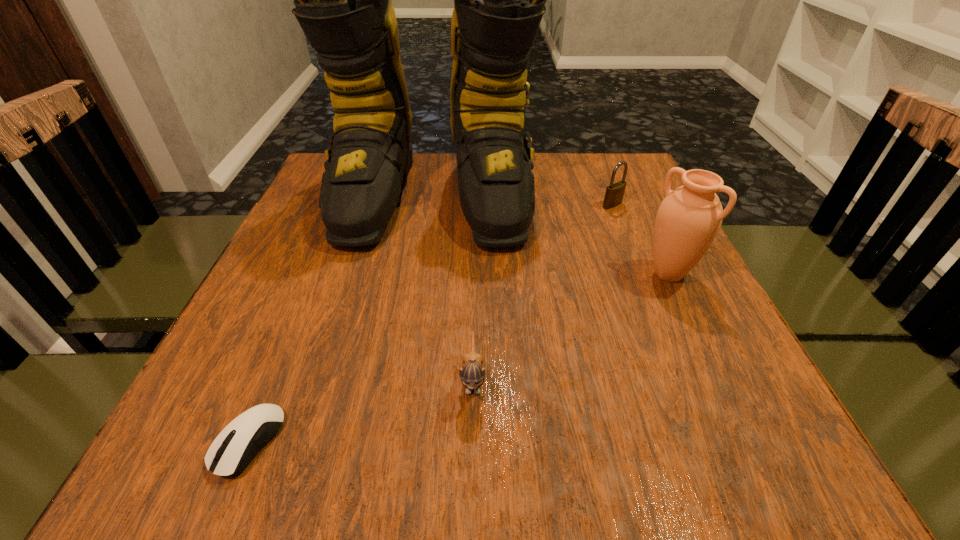
Locate an element on the screen. ski boots is located at coordinates (343, 0).

This screenshot has height=540, width=960. Find the location of `the second tallest object`. the second tallest object is located at coordinates (688, 219).

This screenshot has width=960, height=540. I want to click on urn, so click(x=688, y=219).

I want to click on padlock, so click(614, 194).

Where is `kitten`? kitten is located at coordinates (472, 374).

The width and height of the screenshot is (960, 540). In order to click on the shortest object in this screenshot , I will do `click(234, 448)`.

Image resolution: width=960 pixels, height=540 pixels. I want to click on free point located on the right of the ski boots, so click(612, 197).

I want to click on vacant space located on the back of the third nearest object, so click(x=652, y=239).

Where is `vacant region located 0.130m on the front of the third tallest object`? Image resolution: width=960 pixels, height=540 pixels. vacant region located 0.130m on the front of the third tallest object is located at coordinates (628, 243).

This screenshot has height=540, width=960. What are the coordinates of `vacant space positioned on the front-facing side of the kitten` in the screenshot? It's located at (472, 458).